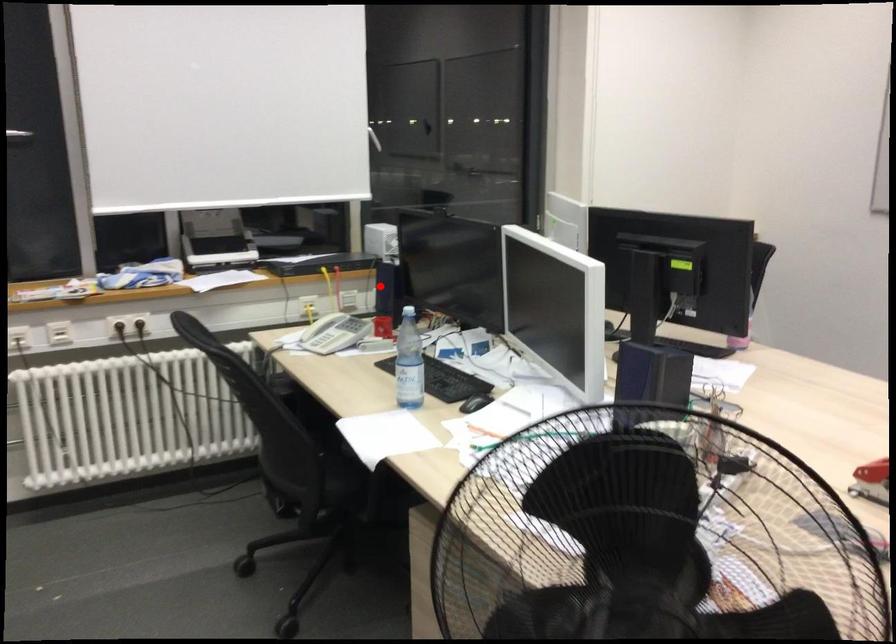
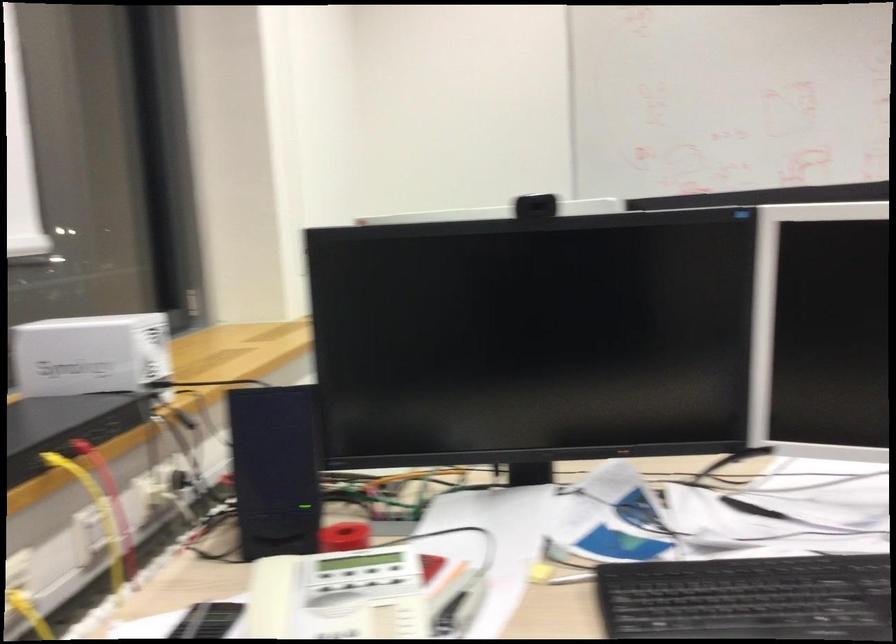
Question: I am providing you with two images of the same scene from different viewpoints. A red point is shown in image1. For the corresponding object point in image2, is it positioned nearer or farther from the camera?

Choices:
 (A) Nearer
 (B) Farther

Answer: (A)